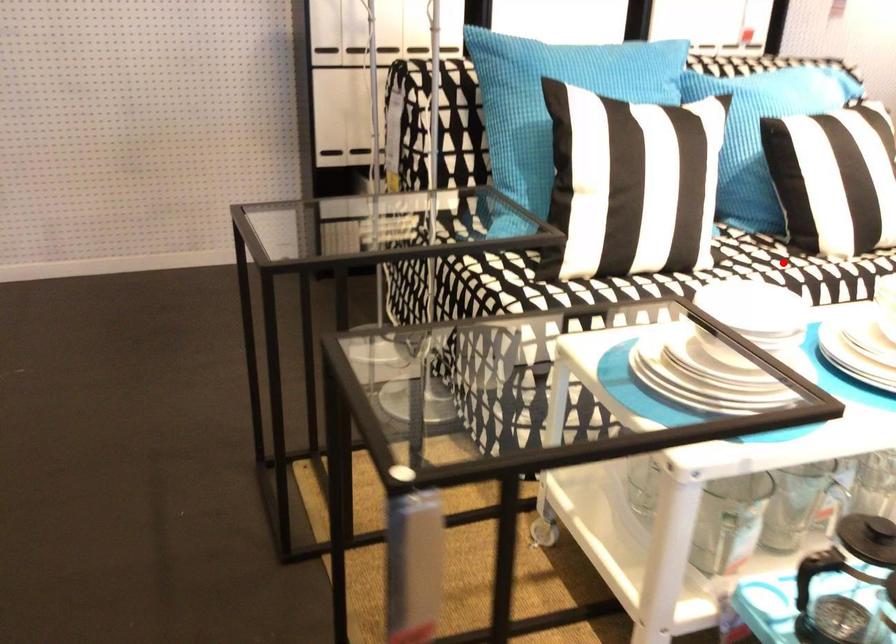
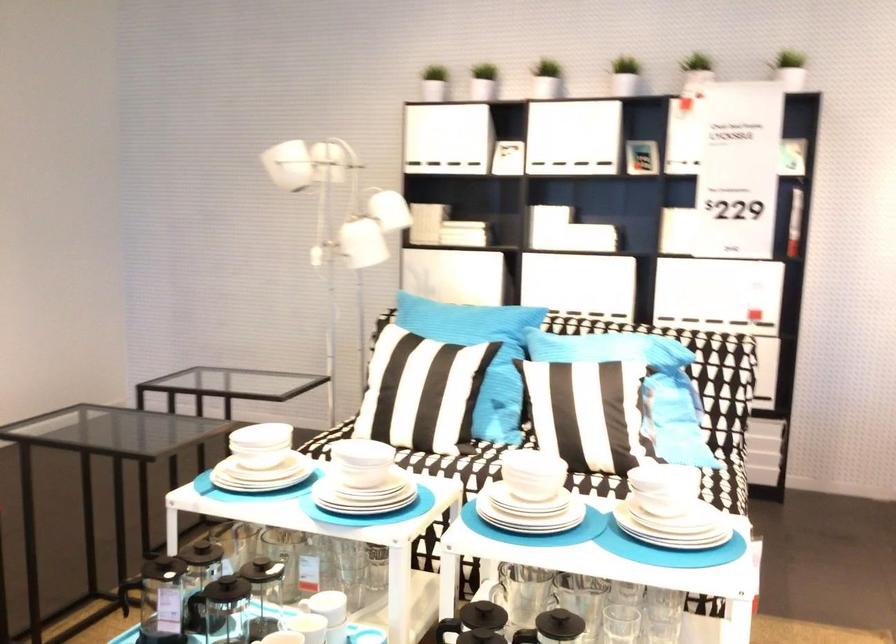
Question: I am providing you with two images of the same scene from different viewpoints. A red point is marked on the first image. Is the red point's position out of view in image 2?

Choices:
 (A) Yes
 (B) No

Answer: (A)